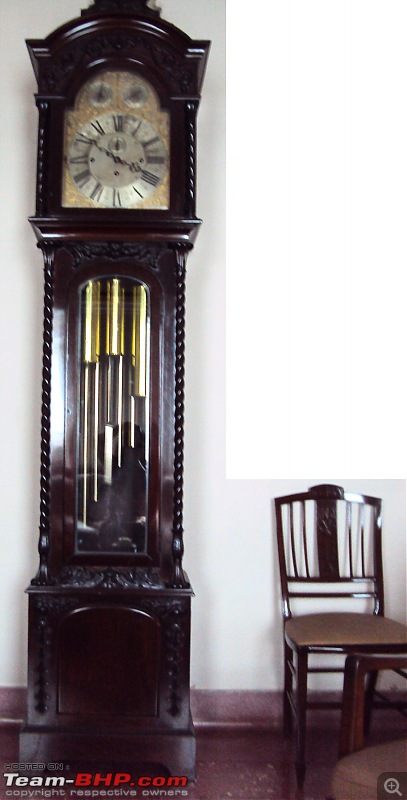
Identify the location of wooden floor. (254, 764).